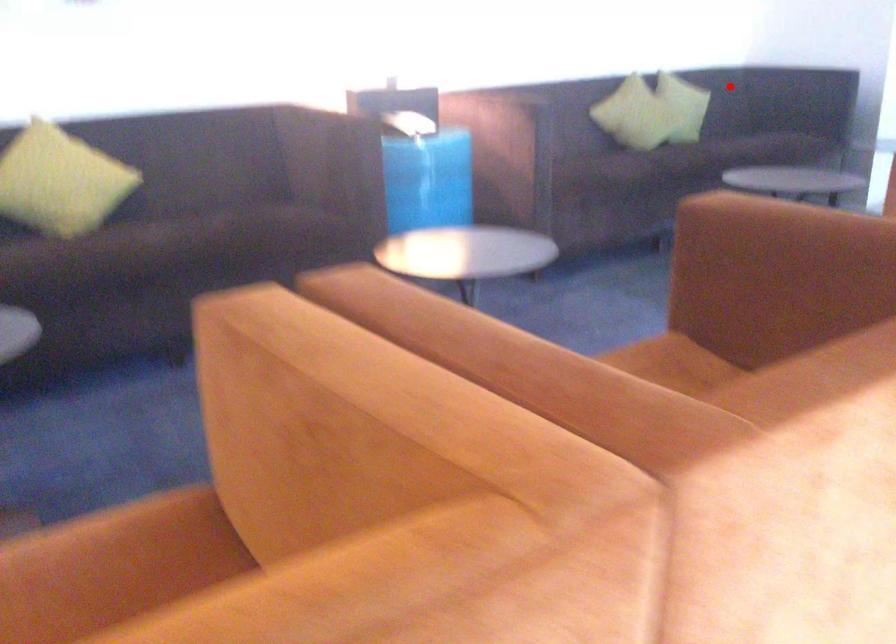
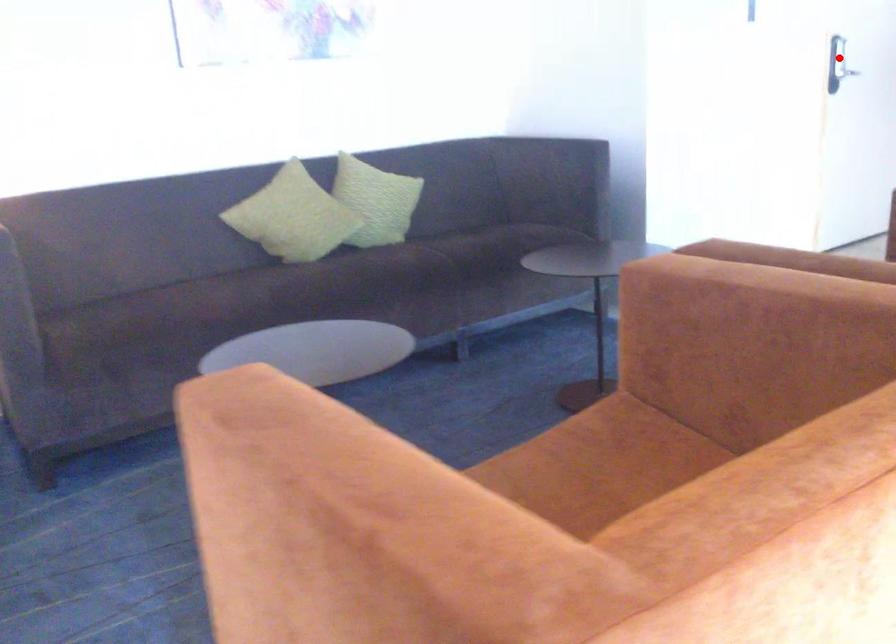
I am providing you with two images of the same scene from different viewpoints. A red point is marked on the first image and another point is marked on the second image. Do the highlighted points in image1 and image2 indicate the same real-world spot?

No